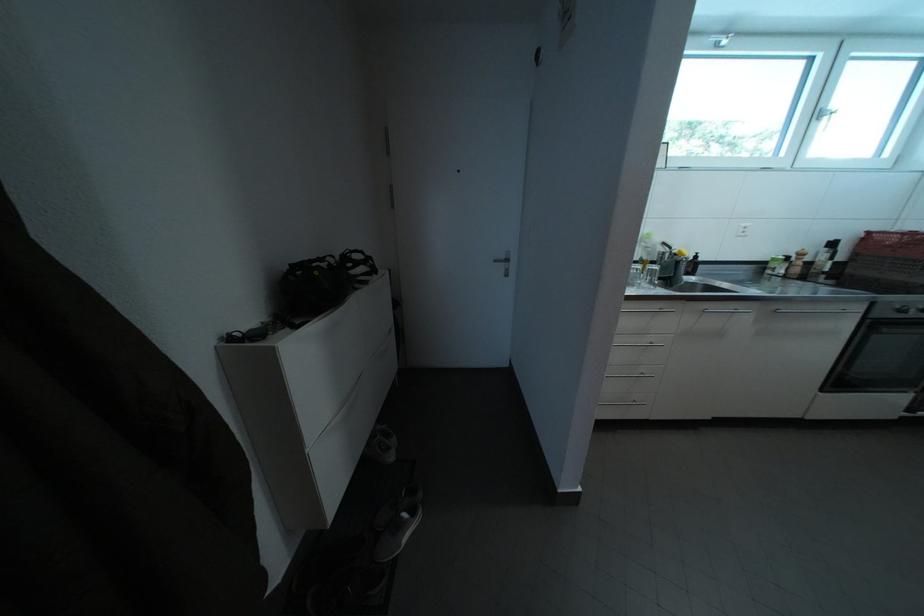
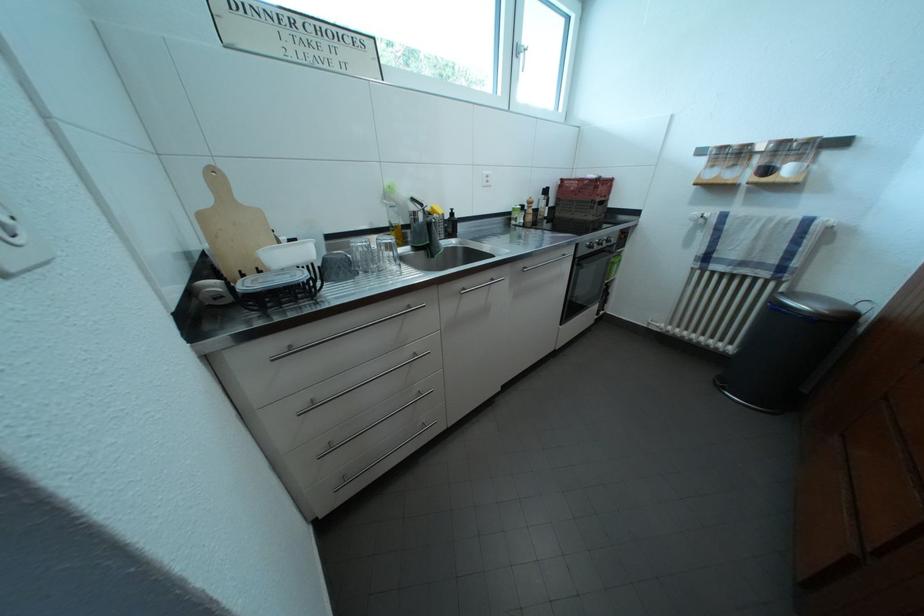
Question: The camera is either moving clockwise (left) or counter-clockwise (right) around the object. The first image is from the beginning of the video and the second image is from the end. Is the camera moving left or right when shooting the video?

Choices:
 (A) Left
 (B) Right

Answer: (A)